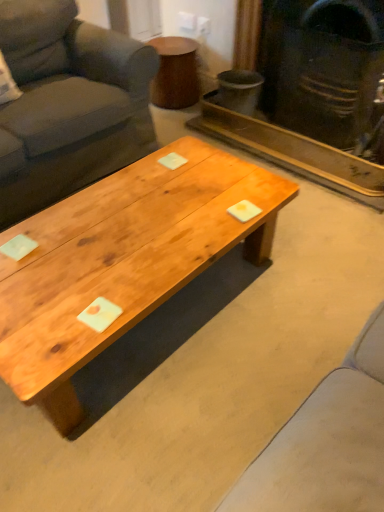
Question: Visually, is wooden side table at upper center positioned to the left or to the right of matte black fireplace at upper right?

Choices:
 (A) left
 (B) right

Answer: (A)

Question: From the image's perspective, is wooden side table at upper center above or below matte black fireplace at upper right?

Choices:
 (A) below
 (B) above

Answer: (B)

Question: Which of these objects is positioned closest to the natural wood coffee table at center?

Choices:
 (A) wooden side table at upper center
 (B) matte black fireplace at upper right
 (C) dark gray fabric couch at left

Answer: (C)

Question: Estimate the real-world distances between objects in this image. Which object is farther from the wooden side table at upper center?

Choices:
 (A) dark gray fabric couch at left
 (B) natural wood coffee table at center
 (C) matte black fireplace at upper right

Answer: (B)